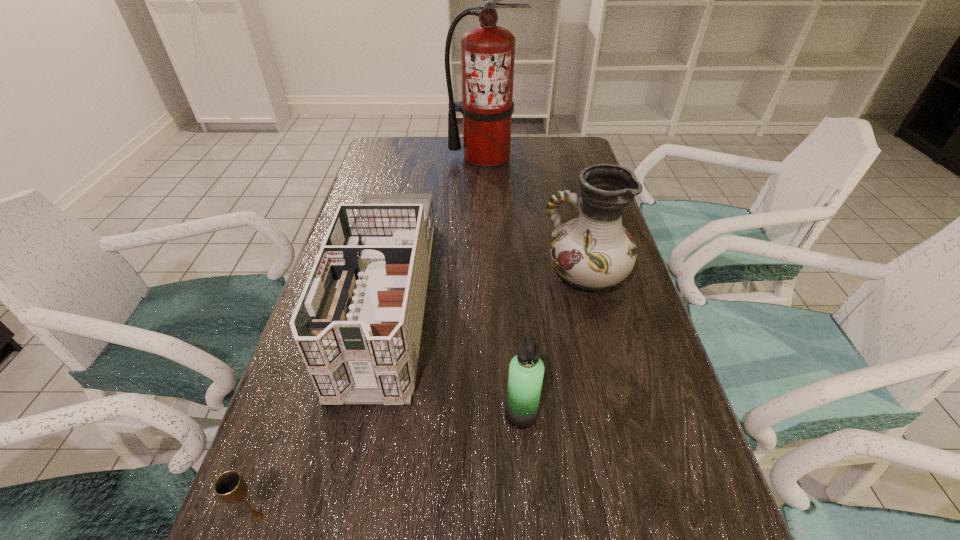
Where is `free spot that satisfies the following two spatial constraints: 1. toward the nozzle of the farthest object; 2. on the left side of the thermos bottle`? Image resolution: width=960 pixels, height=540 pixels. free spot that satisfies the following two spatial constraints: 1. toward the nozzle of the farthest object; 2. on the left side of the thermos bottle is located at coordinates (489, 415).

The height and width of the screenshot is (540, 960). Find the location of `vacant space that satisfies the following two spatial constraints: 1. at the entrance of the dollhouse; 2. on the right side of the thermos bottle`. vacant space that satisfies the following two spatial constraints: 1. at the entrance of the dollhouse; 2. on the right side of the thermos bottle is located at coordinates (362, 415).

At what (x,y) coordinates should I click in order to perform the action: click on vacant region that satisfies the following two spatial constraints: 1. on the back side of the nearest object; 2. on the left side of the thermos bottle. Please return your answer as a coordinate pair (x, y). Looking at the image, I should click on (293, 415).

At what (x,y) coordinates should I click in order to perform the action: click on free region that satisfies the following two spatial constraints: 1. at the entrance of the thermos bottle; 2. on the right side of the fourth object from right to left. Please return your answer as a coordinate pair (x, y). Looking at the image, I should click on [x=362, y=415].